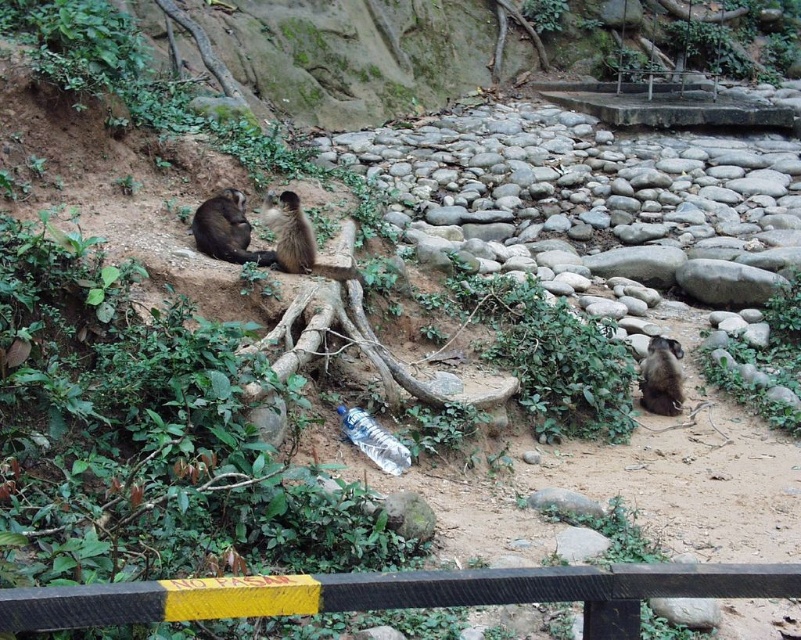
Question: Is fuzzy brown monkey at lower right bigger than transparent plastic bottle at center?

Choices:
 (A) no
 (B) yes

Answer: (B)

Question: Estimate the real-world distances between objects in this image. Which object is farther from the fuzzy brown monkey at center?

Choices:
 (A) fuzzy brown monkey at lower right
 (B) transparent plastic bottle at center
 (C) brown fur monkey at center

Answer: (A)

Question: Can you confirm if fuzzy brown monkey at center is bigger than fuzzy brown monkey at lower right?

Choices:
 (A) yes
 (B) no

Answer: (A)

Question: Is fuzzy brown monkey at lower right thinner than transparent plastic bottle at center?

Choices:
 (A) yes
 (B) no

Answer: (A)

Question: Which object is farther from the camera taking this photo?

Choices:
 (A) fuzzy brown monkey at lower right
 (B) transparent plastic bottle at center

Answer: (A)

Question: Which point appears farthest from the camera in this image?

Choices:
 (A) (196, 236)
 (B) (345, 435)
 (C) (280, 195)
 (D) (661, 339)

Answer: (C)